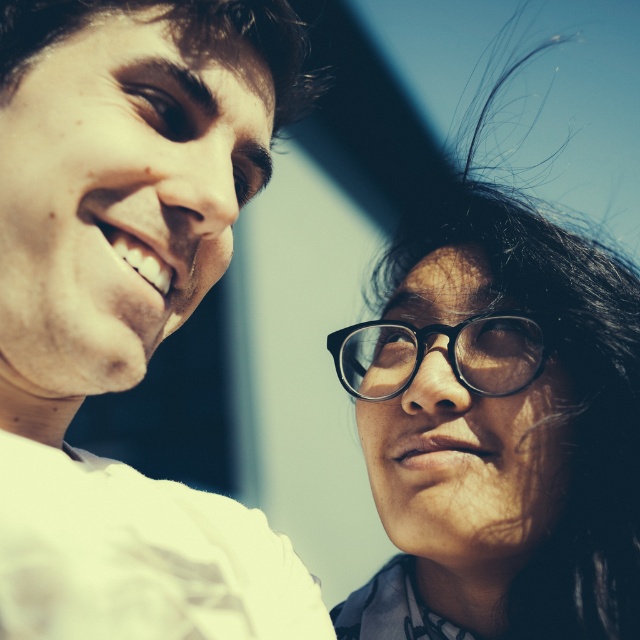
You are a photographer adjusting the focus on your camera. You notice two pairs of black plastic glasses in the scene. Which pair of black plastic glasses at right or black plastic glasses at lower right has a greater width?

The black plastic glasses at right has a greater width than the black plastic glasses at lower right.

You are a photographer adjusting the focus of your camera. The camera can only focus on objects within a 15 centimeter range. Given the distance between the matte white shirt at left and the black plastic glasses at lower right, can both objects be in focus simultaneously?

The matte white shirt at left is 17.68 centimeters away from the black plastic glasses at lower right. Since the distance exceeds the 15 centimeter focus range, both objects cannot be in focus at the same time.